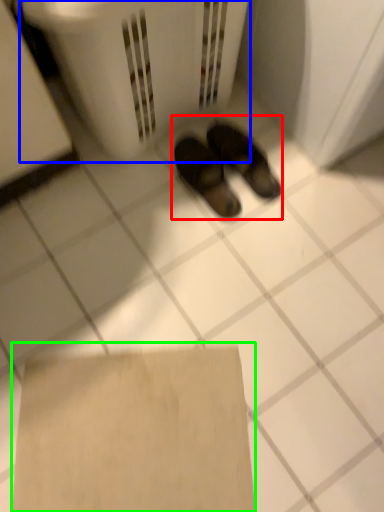
Question: Considering the real-world distances, which object is farthest from footwear (highlighted by a red box)? laundry basket (highlighted by a blue box) or cardboard (highlighted by a green box)?

Choices:
 (A) laundry basket
 (B) cardboard

Answer: (B)